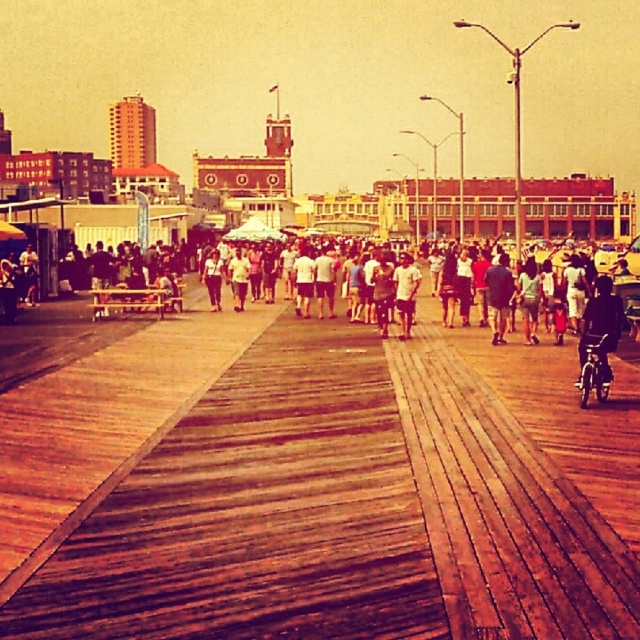
Where is `light brown shorts at center`? The image size is (640, 640). light brown shorts at center is located at coordinates (404, 292).

Between light brown shorts at center and light brown leather jacket at center, which one appears on the right side from the viewer's perspective?

From the viewer's perspective, light brown shorts at center appears more on the right side.

Is point (417, 268) closer to viewer compared to point (209, 266)?

Yes, point (417, 268) is in front of point (209, 266).

Identify the location of light brown shorts at center. (404, 292).

The height and width of the screenshot is (640, 640). What do you see at coordinates (600, 326) in the screenshot?
I see `dark matte jacket at center-right` at bounding box center [600, 326].

Who is shorter, dark matte jacket at center-right or dark blue jeans at center?

dark matte jacket at center-right is shorter.

Which is behind, point (616, 296) or point (486, 285)?

The point (486, 285) is behind.

The width and height of the screenshot is (640, 640). I want to click on dark matte jacket at center-right, so click(x=600, y=326).

Between dark blue jeans at center and light brown shorts at center, which one is positioned lower?

light brown shorts at center is below.

From the picture: Which of these two, dark blue jeans at center or light brown shorts at center, stands taller?

dark blue jeans at center is taller.

Where is `dark blue jeans at center`? dark blue jeans at center is located at coordinates (499, 296).